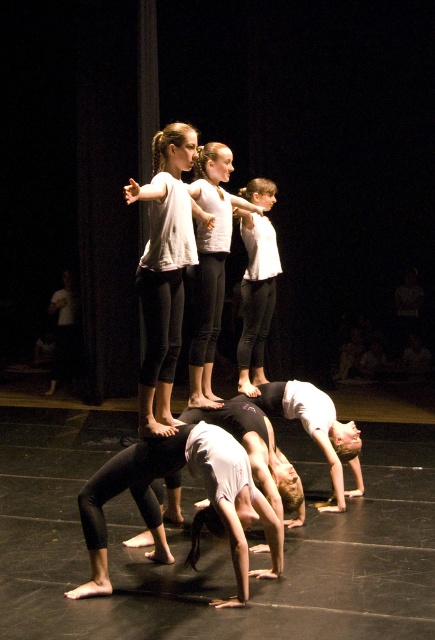
Question: Which of the following is the farthest from the observer?

Choices:
 (A) (224, 257)
 (B) (177, 157)

Answer: (A)

Question: Observing the image, what is the correct spatial positioning of matte white shirt at center in reference to white matte shirt at center?

Choices:
 (A) below
 (B) above

Answer: (A)

Question: Which of the following is the closest to the observer?

Choices:
 (A) white matte t-shirt at center
 (B) white matte shirt at center
 (C) matte white shirt at center

Answer: (C)

Question: Is matte white shirt at center positioned behind white matte t-shirt at center?

Choices:
 (A) yes
 (B) no

Answer: (B)

Question: Does white matte t-shirt at center appear under white matte shirt at center?

Choices:
 (A) yes
 (B) no

Answer: (B)

Question: Which object appears farthest from the camera in this image?

Choices:
 (A) matte white shirt at center
 (B) white matte t-shirt at center
 (C) white matte shirt at center

Answer: (C)